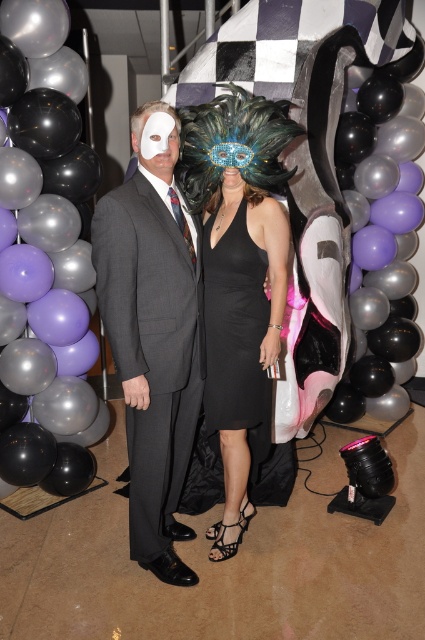
Is black glossy balloon at left shorter than black sheer dress at center?

No, black glossy balloon at left is not shorter than black sheer dress at center.

Find the location of `black glossy balloon at left`. black glossy balloon at left is located at coordinates (44, 250).

Can you confirm if matte gray suit at center is positioned to the right of black satin dress at center?

Incorrect, matte gray suit at center is not on the right side of black satin dress at center.

Is matte gray suit at center smaller than black satin dress at center?

No, matte gray suit at center is not smaller than black satin dress at center.

This screenshot has height=640, width=425. What are the coordinates of `matte gray suit at center` in the screenshot? It's located at (153, 333).

Which is in front, point (3, 250) or point (226, 141)?

Positioned in front is point (226, 141).

Between black glossy balloon at left and black satin dress at center, which one is positioned higher?

Positioned higher is black glossy balloon at left.

Which is behind, point (42, 227) or point (223, 291)?

Point (42, 227)

Locate an element on the screen. The width and height of the screenshot is (425, 640). black glossy balloon at left is located at coordinates (44, 250).